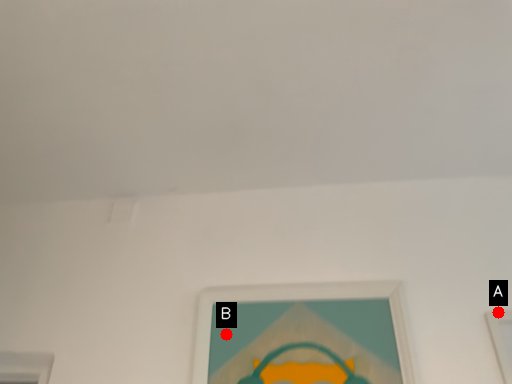
Question: Two points are circled on the image, labeled by A and B beside each circle. Among these points, which one is farthest from the camera?

Choices:
 (A) A is further
 (B) B is further

Answer: (B)